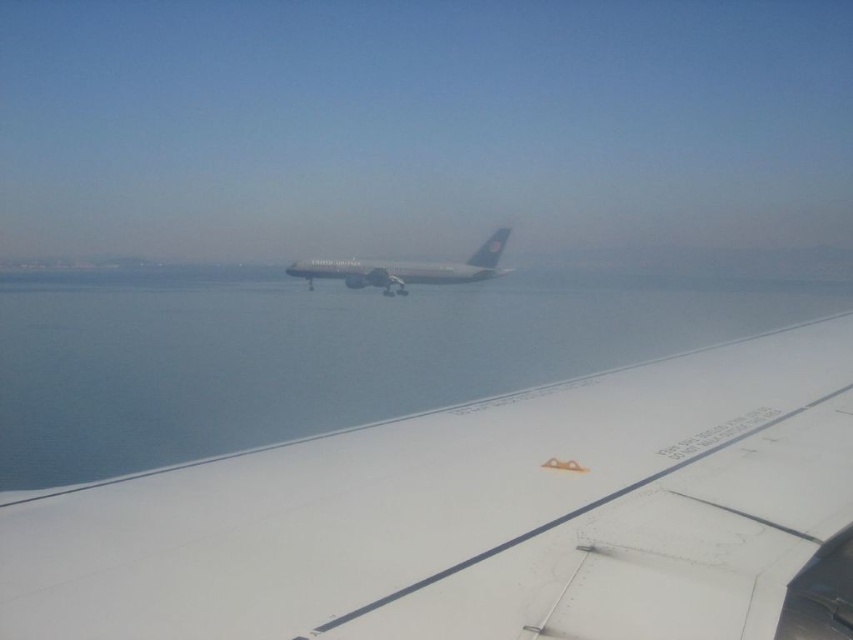
Which is in front, point (788, 289) or point (329, 272)?

Point (329, 272)

This screenshot has height=640, width=853. Identify the location of blue water at center. (316, 353).

In the scene shown: Who is more forward, (149,332) or (492,237)?

Point (149,332) is in front.

In order to click on blue water at center in this screenshot , I will do `click(316, 353)`.

Looking at this image, between white matte wing at center and white glossy airplane wing at center, which one appears on the right side from the viewer's perspective?

white matte wing at center is more to the right.

Is white matte wing at center taller than white glossy airplane wing at center?

No.

Between point (631, 484) and point (344, 269), which one is positioned behind?

The point (344, 269) is behind.

Locate an element on the screen. white matte wing at center is located at coordinates (473, 515).

Can you confirm if silver metallic airplane at center is positioned to the right of white glossy airplane wing at center?

Indeed, silver metallic airplane at center is positioned on the right side of white glossy airplane wing at center.

Between silver metallic airplane at center and white glossy airplane wing at center, which one is positioned higher?

Positioned higher is white glossy airplane wing at center.

Locate an element on the screen. The width and height of the screenshot is (853, 640). silver metallic airplane at center is located at coordinates (415, 269).